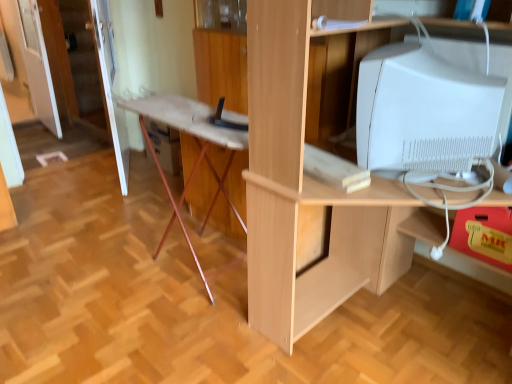
Locate an element on the screen. The width and height of the screenshot is (512, 384). vacant space underneath wooden ironing board at center (from a real-world perspective) is located at coordinates (181, 252).